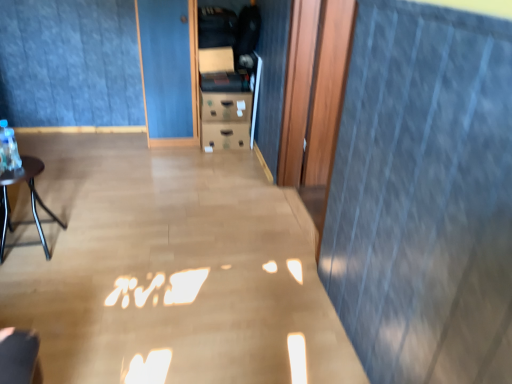
Question: From the image's perspective, does blue fabric curtain at upper center appear lower than matte black table at left?

Choices:
 (A) yes
 (B) no

Answer: (B)

Question: Does blue fabric curtain at upper center have a greater height compared to matte black table at left?

Choices:
 (A) no
 (B) yes

Answer: (B)

Question: Considering the relative sizes of blue fabric curtain at upper center and matte black table at left in the image provided, is blue fabric curtain at upper center wider than matte black table at left?

Choices:
 (A) yes
 (B) no

Answer: (B)

Question: Could you tell me if blue fabric curtain at upper center is facing matte black table at left?

Choices:
 (A) no
 (B) yes

Answer: (B)

Question: Is blue fabric curtain at upper center bigger than matte black table at left?

Choices:
 (A) yes
 (B) no

Answer: (A)

Question: Is blue fabric curtain at upper center oriented away from matte black table at left?

Choices:
 (A) no
 (B) yes

Answer: (A)

Question: From the image's perspective, is matte black table at left beneath blue fabric curtain at upper center?

Choices:
 (A) no
 (B) yes

Answer: (B)

Question: Considering the relative sizes of matte black table at left and blue fabric curtain at upper center in the image provided, is matte black table at left wider than blue fabric curtain at upper center?

Choices:
 (A) no
 (B) yes

Answer: (B)

Question: From a real-world perspective, is matte black table at left on top of blue fabric curtain at upper center?

Choices:
 (A) yes
 (B) no

Answer: (B)

Question: Can you confirm if matte black table at left is thinner than blue fabric curtain at upper center?

Choices:
 (A) no
 (B) yes

Answer: (A)

Question: Does matte black table at left have a smaller size compared to blue fabric curtain at upper center?

Choices:
 (A) yes
 (B) no

Answer: (A)

Question: From a real-world perspective, does matte black table at left sit lower than blue fabric curtain at upper center?

Choices:
 (A) no
 (B) yes

Answer: (B)

Question: From the image's perspective, is matte black table at left located above or below blue fabric curtain at upper center?

Choices:
 (A) above
 (B) below

Answer: (B)